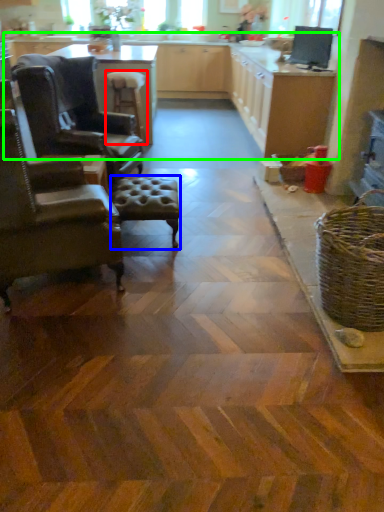
Question: Based on their relative distances, which object is farther from stool (highlighted by a red box)? Choose from stool (highlighted by a blue box) and counter top (highlighted by a green box).

Choices:
 (A) stool
 (B) counter top

Answer: (A)